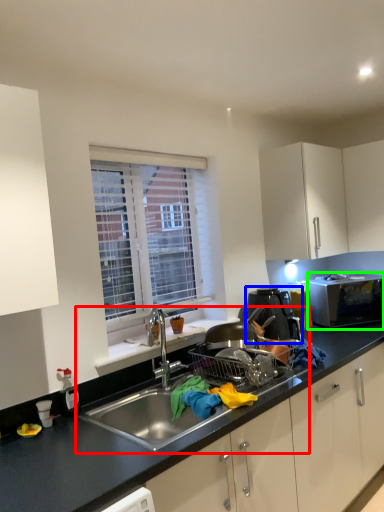
Question: Which object is the closest to the sink (highlighted by a red box)? Choose among these: home appliance (highlighted by a blue box) or microwave oven (highlighted by a green box).

Choices:
 (A) home appliance
 (B) microwave oven

Answer: (A)